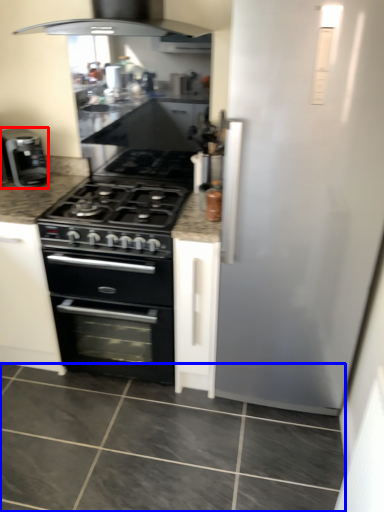
Question: Which of the following is the closest to the observer, kitchen appliance (highlighted by a red box) or granite (highlighted by a blue box)?

Choices:
 (A) kitchen appliance
 (B) granite

Answer: (B)